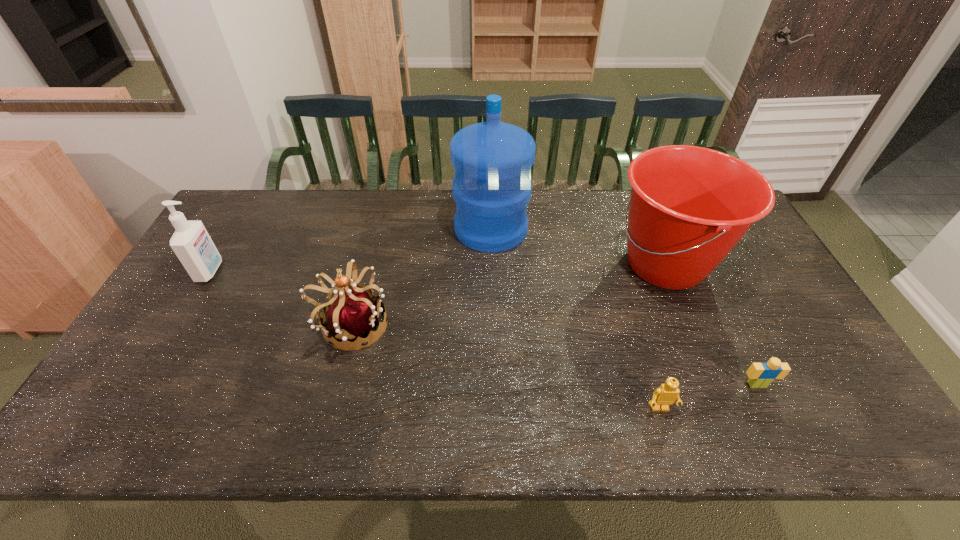
This screenshot has width=960, height=540. In order to click on the tallest object in this screenshot , I will do `click(491, 188)`.

The image size is (960, 540). I want to click on the fourth object from right to left, so click(491, 188).

At what (x,y) coordinates should I click in order to perform the action: click on the second tallest object. Please return your answer as a coordinate pair (x, y). This screenshot has height=540, width=960. Looking at the image, I should click on (689, 206).

You are a GUI agent. You are given a task and a screenshot of the screen. Output one action in this format:
    pyautogui.click(x=<x>, y=<y>)
    Task: Click on the cleansing agent
    The width and height of the screenshot is (960, 540).
    Given the screenshot: What is the action you would take?
    pyautogui.click(x=191, y=242)

Locate an element on the screen. Image resolution: width=960 pixels, height=540 pixels. the fourth shortest object is located at coordinates (191, 242).

Where is `the fifth object from right to left`? The image size is (960, 540). the fifth object from right to left is located at coordinates click(351, 313).

Identify the location of tiara. The width and height of the screenshot is (960, 540). (351, 313).

Image resolution: width=960 pixels, height=540 pixels. What are the coordinates of `the nearest object` in the screenshot? It's located at (664, 396).

Find the location of a particular element. The height and width of the screenshot is (540, 960). the left Lego is located at coordinates (664, 396).

Find the location of `the second nearest object`. the second nearest object is located at coordinates (761, 375).